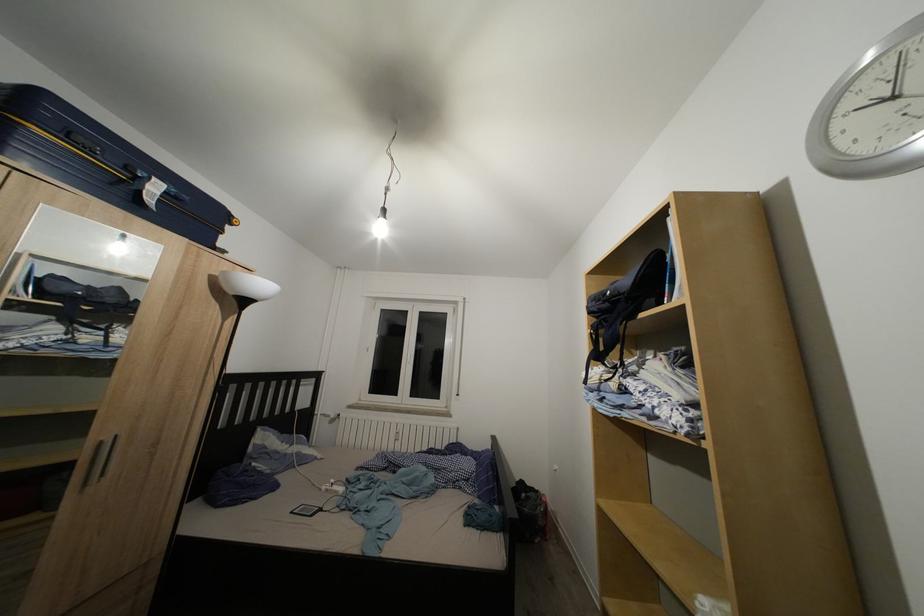
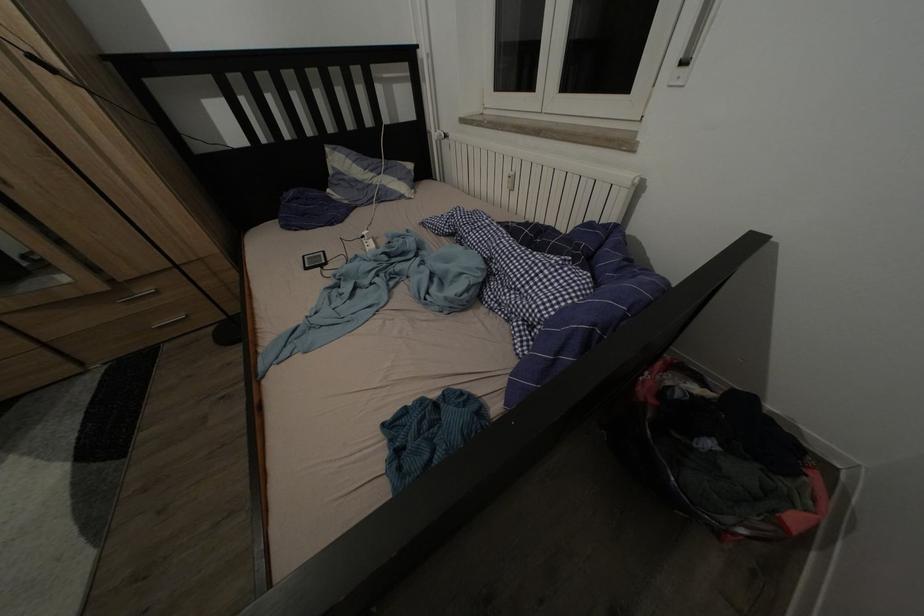
Locate, in the second image, the point that corresponds to point 341,487 in the first image.

(372, 238)